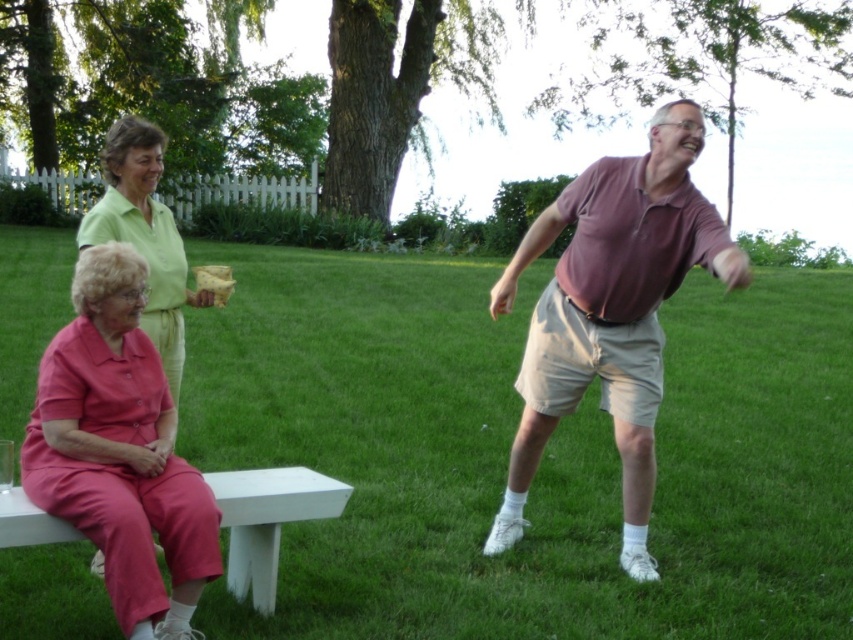
Is matte purple shirt at center positioned before pink fabric pants at lower left?

No, matte purple shirt at center is further to the viewer.

Is matte purple shirt at center above pink fabric pants at lower left?

Yes, matte purple shirt at center is above pink fabric pants at lower left.

Is point (680, 141) behind point (126, 621)?

Yes, it is.

Image resolution: width=853 pixels, height=640 pixels. What are the coordinates of `matte purple shirt at center` in the screenshot? It's located at (611, 310).

Is matte purple shirt at center wider than white matte bench at lower left?

Yes.

Locate an element on the screen. This screenshot has height=640, width=853. matte purple shirt at center is located at coordinates (611, 310).

Who is shorter, pink fabric pants at lower left or white matte bench at lower left?

With less height is white matte bench at lower left.

Is point (161, 592) farther from camera compared to point (292, 472)?

No, it is not.

In order to click on pink fabric pants at lower left in this screenshot , I will do `click(120, 451)`.